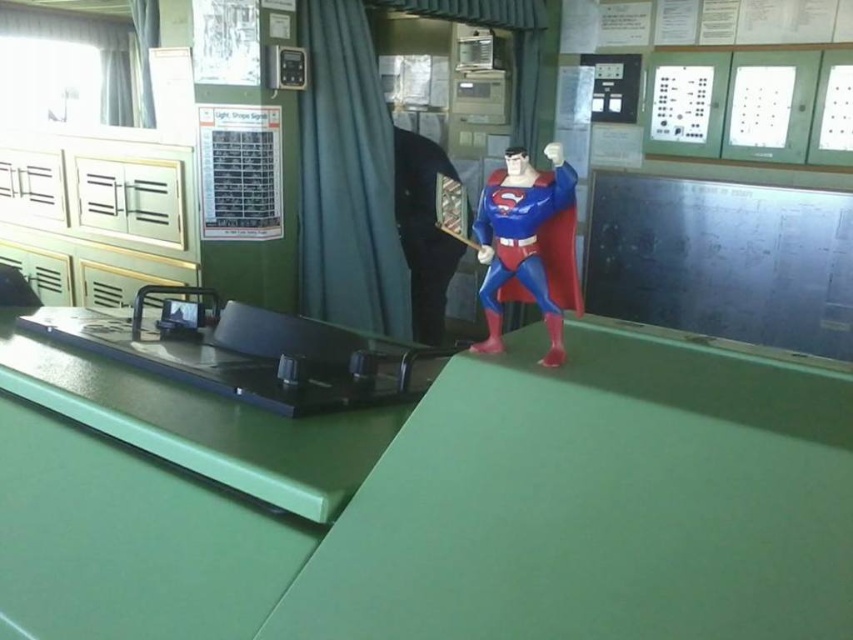
Question: Among these points, which one is nearest to the camera?

Choices:
 (A) (427, 248)
 (B) (524, 154)

Answer: (B)

Question: Observing the image, what is the correct spatial positioning of blue plastic superman figure at center in reference to smooth black suit at center?

Choices:
 (A) left
 (B) right

Answer: (B)

Question: Can you confirm if blue plastic superman figure at center is positioned below smooth black suit at center?

Choices:
 (A) no
 (B) yes

Answer: (B)

Question: Which point appears closest to the camera in this image?

Choices:
 (A) (x=437, y=230)
 (B) (x=519, y=160)

Answer: (B)

Question: Is blue plastic superman figure at center smaller than smooth black suit at center?

Choices:
 (A) no
 (B) yes

Answer: (B)